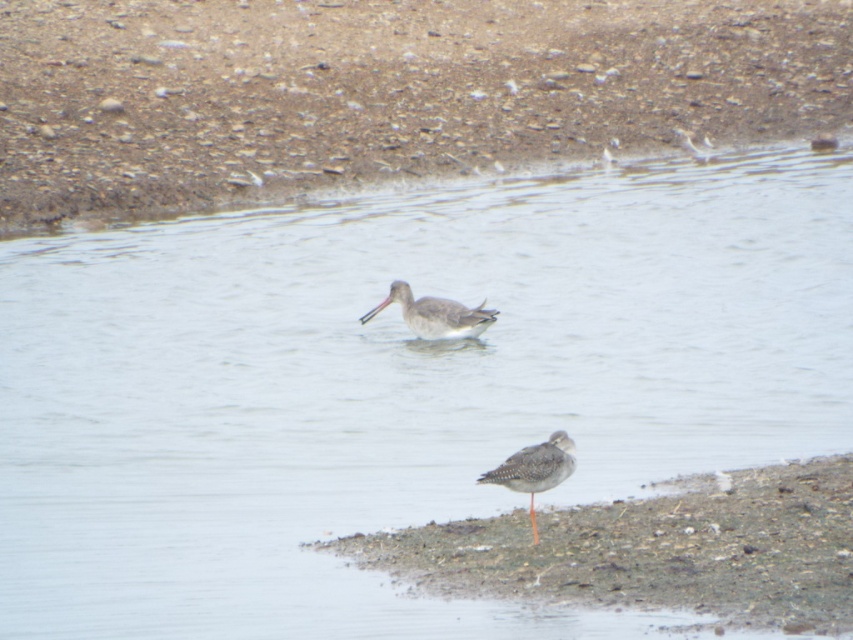
Is brown gravelly sand at upper center thinner than speckled gray bird at lower right?

Correct, brown gravelly sand at upper center's width is less than speckled gray bird at lower right's.

Is point (648, 86) behind point (537, 465)?

Yes, it is behind point (537, 465).

Locate an element on the screen. The width and height of the screenshot is (853, 640). brown gravelly sand at upper center is located at coordinates (381, 90).

Who is more forward, (674,584) or (442,328)?

Positioned in front is point (674,584).

Between brown sandy mud at lower right and gray matte bird at center, which one appears on the left side from the viewer's perspective?

gray matte bird at center is more to the left.

Locate an element on the screen. The image size is (853, 640). brown sandy mud at lower right is located at coordinates (654, 548).

Identify the location of brown sandy mud at lower right. This screenshot has height=640, width=853. (654, 548).

Who is positioned more to the left, brown gravelly sand at upper center or brown sandy mud at lower right?

brown gravelly sand at upper center is more to the left.

Which is more to the right, brown gravelly sand at upper center or brown sandy mud at lower right?

From the viewer's perspective, brown sandy mud at lower right appears more on the right side.

Which is behind, point (633, 36) or point (413, 528)?

The point (633, 36) is behind.

At what (x,y) coordinates should I click in order to perform the action: click on brown gravelly sand at upper center. Please return your answer as a coordinate pair (x, y). This screenshot has height=640, width=853. Looking at the image, I should click on (381, 90).